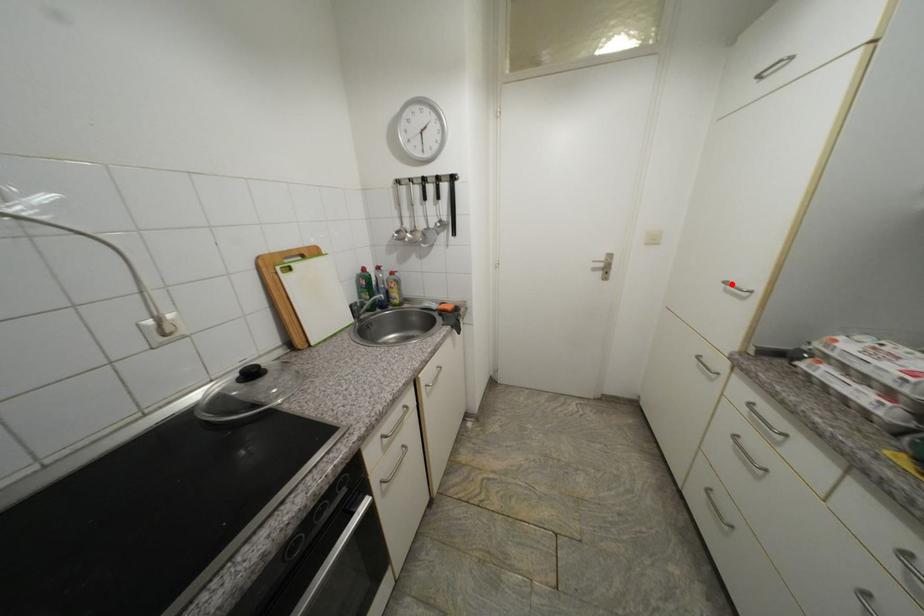
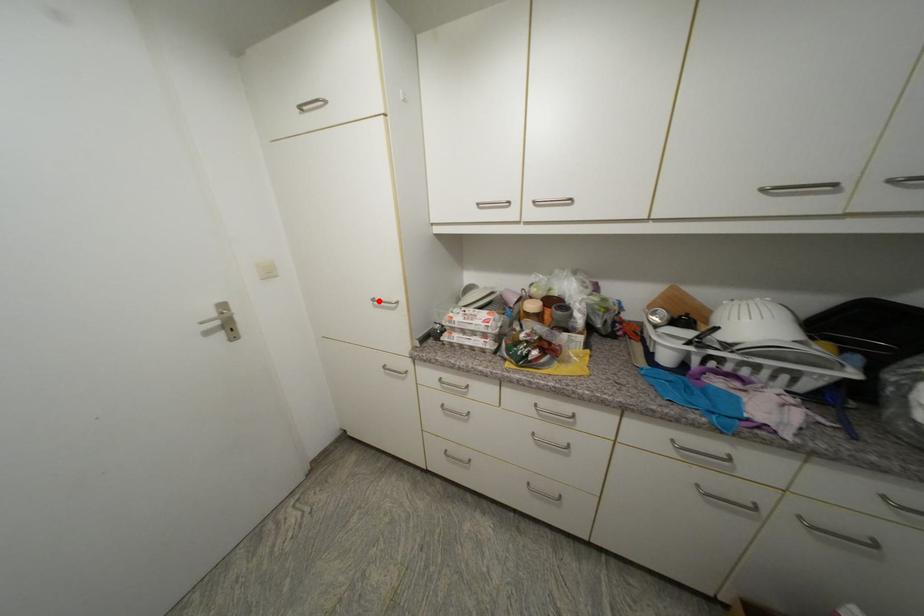
I am providing you with two images of the same scene from different viewpoints. A red point is marked on the first image and another point is marked on the second image. Do the highlighted points in image1 and image2 indicate the same real-world spot?

Yes